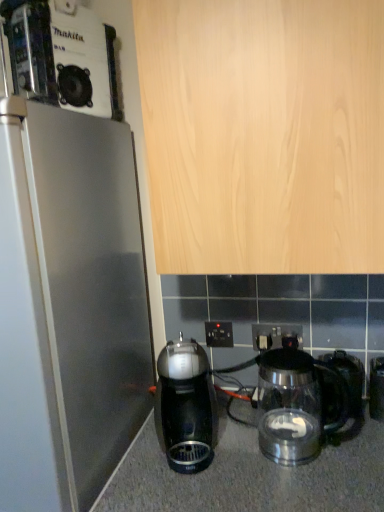
Question: In terms of width, does shiny black coffee maker at center, the second kitchen appliance in the right-to-left sequence, look wider or thinner when compared to black plastic electric outlet at center, the 2th electric outlet in the right-to-left sequence?

Choices:
 (A) thin
 (B) wide

Answer: (B)

Question: Is shiny black coffee maker at center, the second kitchen appliance in the right-to-left sequence, situated inside black plastic electric outlet at center, the 2th electric outlet in the right-to-left sequence, or outside?

Choices:
 (A) inside
 (B) outside

Answer: (B)

Question: Considering the real-world distances, which object is closest to the transparent glass kettle at lower center, marked as the 2th kitchen appliance in a left-to-right arrangement?

Choices:
 (A) translucent glass coffee pot at lower right
 (B) black plastic kettle at lower right
 (C) black plastic electric outlet at center, the 2th electric outlet in the right-to-left sequence
 (D) shiny black coffee maker at center, the first kitchen appliance from the left
 (E) black plastic electric outlet at center, which is counted as the 1th electric outlet, starting from the right

Answer: (A)

Question: Considering the real-world distances, which object is farthest from the black plastic kettle at lower right?

Choices:
 (A) metallic silver coffee maker at upper left
 (B) translucent glass coffee pot at lower right
 (C) black plastic electric outlet at center, the 2th electric outlet in the right-to-left sequence
 (D) transparent glass kettle at lower center, marked as the 2th kitchen appliance in a left-to-right arrangement
 (E) shiny black coffee maker at center, the first kitchen appliance from the left

Answer: (A)